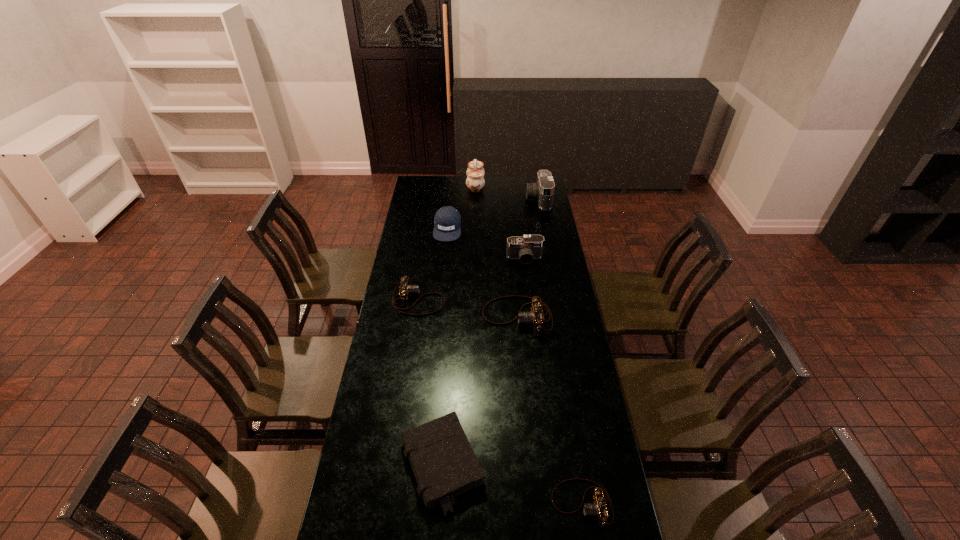
This screenshot has height=540, width=960. Find the location of `camera that is at the left edge`. camera that is at the left edge is located at coordinates (405, 289).

This screenshot has height=540, width=960. In order to click on Bible located in the left edge section of the desktop in this screenshot , I will do `click(443, 462)`.

At what (x,y) coordinates should I click in order to perform the action: click on object situated at the far right corner. Please return your answer as a coordinate pair (x, y). The image size is (960, 540). Looking at the image, I should click on (543, 190).

Where is `vacant region at the far edge of the desktop`? The width and height of the screenshot is (960, 540). vacant region at the far edge of the desktop is located at coordinates (474, 193).

The width and height of the screenshot is (960, 540). In the image, there is a desktop. Find the location of `free space at the left edge`. free space at the left edge is located at coordinates (412, 353).

Find the location of `vacant space at the right edge of the desktop`. vacant space at the right edge of the desktop is located at coordinates (532, 220).

The width and height of the screenshot is (960, 540). I want to click on vacant space that's between the biggest brown camera and the chinaware, so 496,251.

What are the coordinates of `free area in between the fourth farthest object and the Bible` in the screenshot? It's located at (484, 362).

Where is `vacant point located between the smallest brown camera and the fourth nearest camera`? This screenshot has height=540, width=960. vacant point located between the smallest brown camera and the fourth nearest camera is located at coordinates (553, 381).

You are a GUI agent. You are given a task and a screenshot of the screen. Output one action in this format:
    pyautogui.click(x=<x>, y=<y>)
    Task: Click on the empty location between the bigger black camera and the Bible
    This screenshot has width=960, height=540.
    Given the screenshot: What is the action you would take?
    pyautogui.click(x=491, y=332)